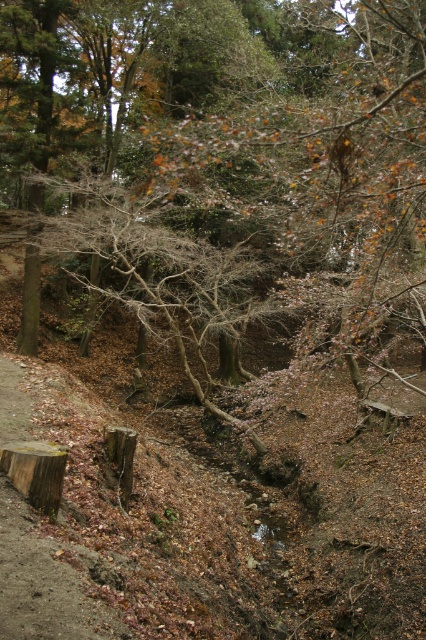
Between point (391, 99) and point (75, 573), which one is positioned behind?

The point (391, 99) is behind.

Is brown textured tree at center wider than brown mossy log at lower left?

Correct, the width of brown textured tree at center exceeds that of brown mossy log at lower left.

Find the location of a particular element. The width and height of the screenshot is (426, 640). brown textured tree at center is located at coordinates (218, 150).

Can you confirm if brown textured tree at center is positioned below brown rough tree stump at center?

No, brown textured tree at center is not below brown rough tree stump at center.

Which is in front, point (400, 244) or point (112, 452)?

Point (112, 452) is more forward.

Measure the distance between brown textured tree at center and camera.

A distance of 13.94 feet exists between brown textured tree at center and camera.

Where is `brown textured tree at center`? This screenshot has width=426, height=640. brown textured tree at center is located at coordinates (218, 150).

Looking at this image, between brown mossy log at lower left and brown rough tree stump at center, which one appears on the left side from the viewer's perspective?

From the viewer's perspective, brown mossy log at lower left appears more on the left side.

Between point (8, 426) and point (112, 440), which one is positioned in front?

Positioned in front is point (8, 426).

Which is behind, point (28, 593) or point (117, 444)?

Point (117, 444)

Locate an element on the screen. Image resolution: width=426 pixels, height=640 pixels. brown mossy log at lower left is located at coordinates (46, 580).